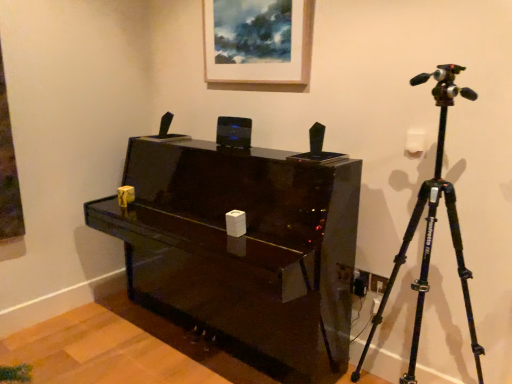
Question: Is glossy black piano at center oriented away from wooden picture frame at upper center?

Choices:
 (A) no
 (B) yes

Answer: (A)

Question: Is glossy black piano at center wider than wooden picture frame at upper center?

Choices:
 (A) no
 (B) yes

Answer: (B)

Question: From the image's perspective, does glossy black piano at center appear lower than wooden picture frame at upper center?

Choices:
 (A) yes
 (B) no

Answer: (A)

Question: Does glossy black piano at center have a greater height compared to wooden picture frame at upper center?

Choices:
 (A) yes
 (B) no

Answer: (A)

Question: Is glossy black piano at center positioned beyond the bounds of wooden picture frame at upper center?

Choices:
 (A) yes
 (B) no

Answer: (A)

Question: Is wooden picture frame at upper center taller or shorter than glossy black piano at center?

Choices:
 (A) tall
 (B) short

Answer: (B)

Question: From the image's perspective, is wooden picture frame at upper center positioned above or below glossy black piano at center?

Choices:
 (A) below
 (B) above

Answer: (B)

Question: Is wooden picture frame at upper center inside or outside of glossy black piano at center?

Choices:
 (A) inside
 (B) outside

Answer: (B)

Question: From a real-world perspective, is wooden picture frame at upper center positioned above or below glossy black piano at center?

Choices:
 (A) above
 (B) below

Answer: (A)

Question: Do you think glossy black piano at center is within wooden picture frame at upper center, or outside of it?

Choices:
 (A) inside
 (B) outside

Answer: (B)

Question: In terms of height, does glossy black piano at center look taller or shorter compared to wooden picture frame at upper center?

Choices:
 (A) short
 (B) tall

Answer: (B)

Question: Is glossy black piano at center bigger or smaller than wooden picture frame at upper center?

Choices:
 (A) big
 (B) small

Answer: (A)

Question: Is point (177, 172) closer or farther from the camera than point (284, 74)?

Choices:
 (A) closer
 (B) farther

Answer: (B)

Question: Considering the positions of point (457, 71) and point (232, 13), is point (457, 71) closer or farther from the camera than point (232, 13)?

Choices:
 (A) closer
 (B) farther

Answer: (A)

Question: Considering the relative positions of black matte tripod at right and wooden picture frame at upper center in the image provided, is black matte tripod at right to the left or to the right of wooden picture frame at upper center?

Choices:
 (A) right
 (B) left

Answer: (A)